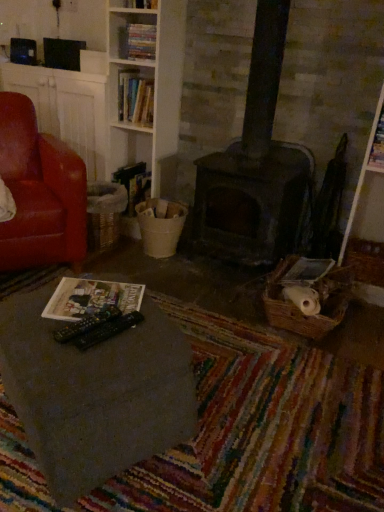
Question: Is matte paper magazine at lower left, which ranks as the second magazine in back-to-front order, to the left of matte paper magazine at upper right, which is the second magazine in left-to-right order, from the viewer's perspective?

Choices:
 (A) yes
 (B) no

Answer: (A)

Question: Is matte paper magazine at lower left, which appears as the 1th magazine when viewed from the front, facing towards matte paper magazine at upper right, which is the second magazine in left-to-right order?

Choices:
 (A) yes
 (B) no

Answer: (B)

Question: Can you confirm if matte paper magazine at lower left, which appears as the 1th magazine when viewed from the front, is shorter than matte paper magazine at upper right, the first magazine when ordered from top to bottom?

Choices:
 (A) yes
 (B) no

Answer: (A)

Question: Is matte paper magazine at lower left, acting as the second magazine starting from the right, at the right side of matte paper magazine at upper right, the first magazine when ordered from top to bottom?

Choices:
 (A) no
 (B) yes

Answer: (A)

Question: Is there a large distance between matte paper magazine at lower left, which ranks as the second magazine in back-to-front order, and matte paper magazine at upper right, the 2th magazine positioned from the bottom?

Choices:
 (A) no
 (B) yes

Answer: (B)

Question: From their relative heights in the image, would you say hardcover book at center, placed as the 1th book when sorted from bottom to top, is taller or shorter than hardcover book at upper center, which is the second book in top-to-bottom order?

Choices:
 (A) short
 (B) tall

Answer: (B)

Question: Is hardcover book at center, placed as the 1th book when sorted from bottom to top, inside the boundaries of hardcover book at upper center, which is the second book in top-to-bottom order, or outside?

Choices:
 (A) inside
 (B) outside

Answer: (B)

Question: From a real-world perspective, is hardcover book at center, placed as the 1th book when sorted from bottom to top, positioned above or below hardcover book at upper center, which is the second book in top-to-bottom order?

Choices:
 (A) below
 (B) above

Answer: (A)

Question: Is hardcover book at center, placed as the third book when sorted from top to bottom, to the left or to the right of hardcover book at upper center, the second book in the bottom-to-top sequence, in the image?

Choices:
 (A) right
 (B) left

Answer: (B)

Question: Is matte paper magazine at lower left, which appears as the 1th magazine when viewed from the front, wider or thinner than hardcover books at upper center, positioned as the 1th book in top-to-bottom order?

Choices:
 (A) thin
 (B) wide

Answer: (B)

Question: From a real-world perspective, is matte paper magazine at lower left, positioned as the second magazine in top-to-bottom order, above or below hardcover books at upper center, the 3th book positioned from the bottom?

Choices:
 (A) above
 (B) below

Answer: (B)

Question: Is matte paper magazine at lower left, which appears as the 1th magazine when viewed from the front, spatially inside hardcover books at upper center, the 3th book positioned from the bottom, or outside of it?

Choices:
 (A) inside
 (B) outside

Answer: (B)

Question: Relative to hardcover books at upper center, positioned as the 1th book in top-to-bottom order, is matte paper magazine at lower left, acting as the second magazine starting from the right, in front or behind?

Choices:
 (A) front
 (B) behind

Answer: (A)

Question: Considering the positions of dark gray stone fireplace at center and leather at left in the image, is dark gray stone fireplace at center bigger or smaller than leather at left?

Choices:
 (A) big
 (B) small

Answer: (B)

Question: Is point (251, 224) closer or farther from the camera than point (29, 157)?

Choices:
 (A) farther
 (B) closer

Answer: (B)